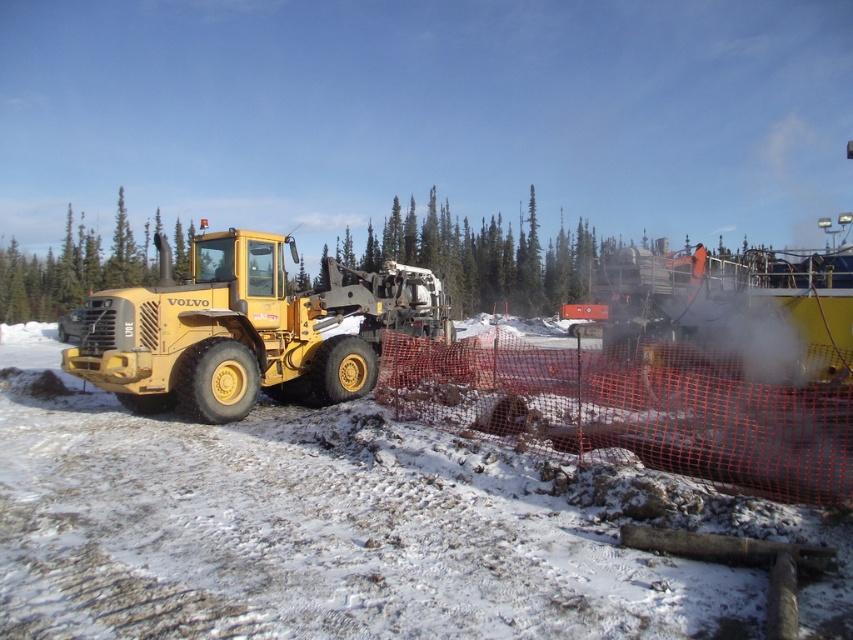
Question: Can you confirm if matte yellow tractor at left is positioned above green leafy tree at center?

Choices:
 (A) yes
 (B) no

Answer: (B)

Question: In this image, where is matte yellow tractor at left located relative to green leafy tree at center?

Choices:
 (A) below
 (B) above

Answer: (A)

Question: Is matte yellow tractor at left below green leafy tree at center?

Choices:
 (A) no
 (B) yes

Answer: (B)

Question: Which point is farther to the camera?

Choices:
 (A) green leafy tree at center
 (B) matte yellow tractor at left

Answer: (A)

Question: Which object is closer to the camera taking this photo?

Choices:
 (A) green leafy tree at center
 (B) matte yellow tractor at left

Answer: (B)